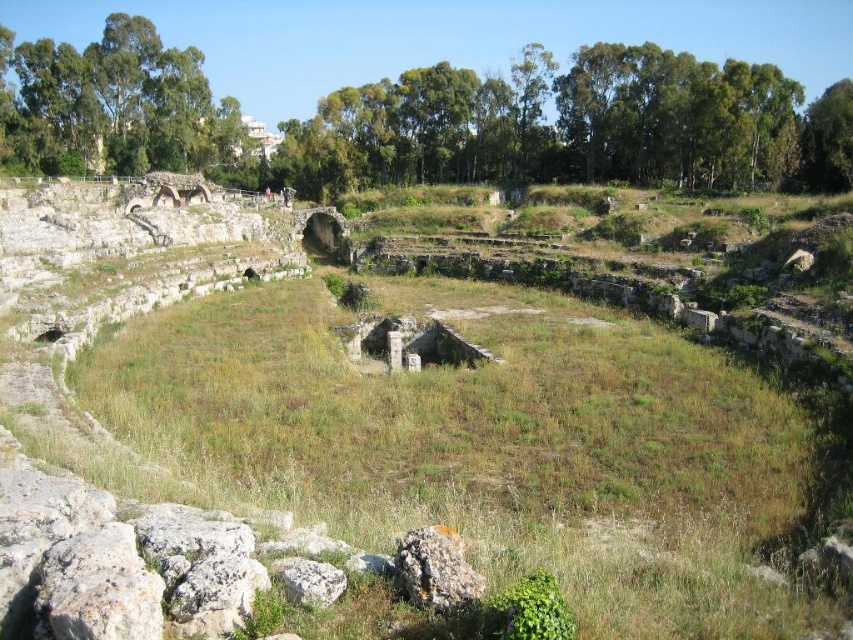
Question: Estimate the real-world distances between objects in this image. Which object is farther from the green grass at center?

Choices:
 (A) rusty metallic rock at center
 (B) white rough stone at center

Answer: (B)

Question: Does green grass at center appear on the right side of white rough stone at center?

Choices:
 (A) no
 (B) yes

Answer: (A)

Question: Which of the following is the farthest from the observer?

Choices:
 (A) (596, 630)
 (B) (332, 589)

Answer: (B)

Question: Is green grass at center thinner than rusty metallic rock at center?

Choices:
 (A) yes
 (B) no

Answer: (B)

Question: Among these objects, which one is farthest from the camera?

Choices:
 (A) green grass at center
 (B) rusty metallic rock at center

Answer: (B)

Question: Does rusty metallic rock at center have a greater width compared to white rough stone at center?

Choices:
 (A) no
 (B) yes

Answer: (B)